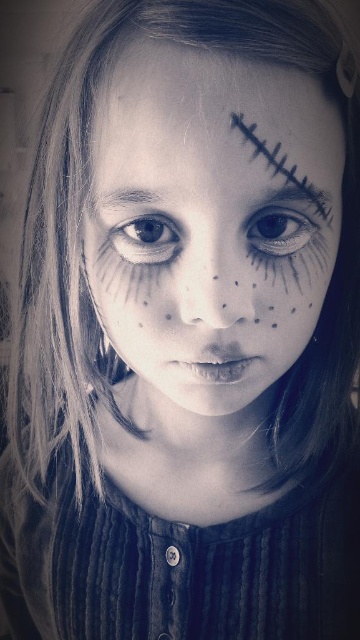
Question: Which point is closer to the camera taking this photo?

Choices:
 (A) (101, 148)
 (B) (151, 257)
 (C) (255, 230)

Answer: (C)

Question: Can you confirm if black matte eyebrow at upper center is smaller than gray matte eyebrow at upper left?

Choices:
 (A) yes
 (B) no

Answer: (B)

Question: Can you confirm if matte black eye at center is thinner than brown matte eye at center?

Choices:
 (A) no
 (B) yes

Answer: (B)

Question: Does matte black eye at center lie behind gray matte eyebrow at upper left?

Choices:
 (A) yes
 (B) no

Answer: (A)

Question: Which of the following is the farthest from the observer?

Choices:
 (A) black matte eyebrow at upper center
 (B) black matte scar at upper center
 (C) matte black eye at center

Answer: (C)

Question: Considering the real-world distances, which object is farthest from the gray matte eyebrow at upper left?

Choices:
 (A) black matte eyebrow at upper center
 (B) matte black eye at center
 (C) matte black face paint at center
 (D) black matte scar at upper center

Answer: (A)